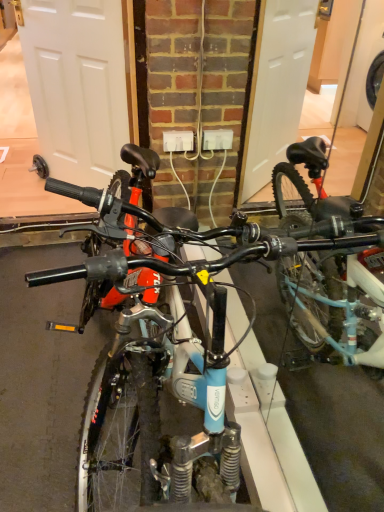
Question: Does point (192, 131) appear closer or farther from the camera than point (311, 334)?

Choices:
 (A) closer
 (B) farther

Answer: (B)

Question: Considering the positions of white plastic power outlet at center and blue matte bicycle at center in the image, is white plastic power outlet at center wider or thinner than blue matte bicycle at center?

Choices:
 (A) wide
 (B) thin

Answer: (B)

Question: Estimate the real-world distances between objects in this image. Which object is farther from the white plastic power outlet at center?

Choices:
 (A) blue matte bicycle at center
 (B) white matte door at left

Answer: (A)

Question: Which of these objects is positioned farthest from the white matte door at left?

Choices:
 (A) blue matte bicycle at center
 (B) white plastic power outlet at center

Answer: (A)